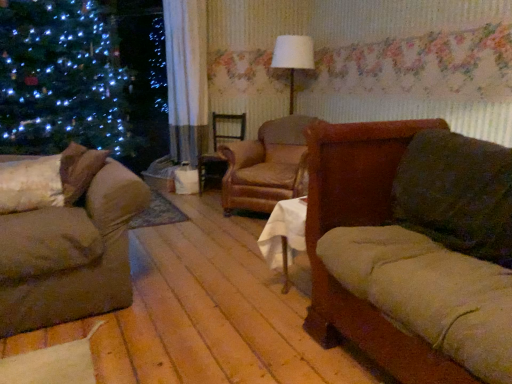
Describe the element at coordinates (362, 224) in the screenshot. I see `velvet brown couch at right, the second studio couch in the left-to-right sequence` at that location.

Describe the element at coordinates (70, 254) in the screenshot. I see `velvet brown couch at left, the first studio couch from the left` at that location.

This screenshot has width=512, height=384. Find the location of `velvet brown couch at right, which appears as the first studio couch when viewed from the right`. velvet brown couch at right, which appears as the first studio couch when viewed from the right is located at coordinates (362, 224).

Does brown leather swivel chair at center lie behind velvet brown couch at left, the first studio couch from the left?

Yes.

Is brown leather swivel chair at center turned away from velvet brown couch at left, which is counted as the 2th studio couch, starting from the right?

No, brown leather swivel chair at center's orientation is not away from velvet brown couch at left, which is counted as the 2th studio couch, starting from the right.

From the image's perspective, is brown leather swivel chair at center on velvet brown couch at left, the first studio couch from the left?

Yes, from the image's perspective, brown leather swivel chair at center is above velvet brown couch at left, the first studio couch from the left.

Looking at this image, is brown leather swivel chair at center far from velvet brown couch at left, the first studio couch from the left?

Indeed, brown leather swivel chair at center is not near velvet brown couch at left, the first studio couch from the left.

Is brown leather swivel chair at center next to velvet brown couch at right, the second studio couch in the left-to-right sequence, and touching it?

No, brown leather swivel chair at center is not beside velvet brown couch at right, the second studio couch in the left-to-right sequence.

Is brown leather swivel chair at center oriented towards velvet brown couch at right, the second studio couch in the left-to-right sequence?

No, brown leather swivel chair at center is not facing towards velvet brown couch at right, the second studio couch in the left-to-right sequence.

Considering the positions of objects brown leather swivel chair at center and velvet brown couch at right, which appears as the first studio couch when viewed from the right, in the image provided, who is in front, brown leather swivel chair at center or velvet brown couch at right, which appears as the first studio couch when viewed from the right,?

A: velvet brown couch at right, which appears as the first studio couch when viewed from the right, is closer to the camera.

Is brown leather swivel chair at center to the right of velvet brown couch at right, which appears as the first studio couch when viewed from the right, from the viewer's perspective?

Incorrect, brown leather swivel chair at center is not on the right side of velvet brown couch at right, which appears as the first studio couch when viewed from the right.

Does velvet brown couch at left, which is counted as the 2th studio couch, starting from the right, appear on the left side of velvet brown couch at right, the second studio couch in the left-to-right sequence?

Yes, velvet brown couch at left, which is counted as the 2th studio couch, starting from the right, is to the left of velvet brown couch at right, the second studio couch in the left-to-right sequence.

Is velvet brown couch at left, which is counted as the 2th studio couch, starting from the right, aimed at velvet brown couch at right, which appears as the first studio couch when viewed from the right?

No, velvet brown couch at left, which is counted as the 2th studio couch, starting from the right, is not oriented towards velvet brown couch at right, which appears as the first studio couch when viewed from the right.

Can you confirm if velvet brown couch at left, the first studio couch from the left, is wider than velvet brown couch at right, the second studio couch in the left-to-right sequence?

Correct, the width of velvet brown couch at left, the first studio couch from the left, exceeds that of velvet brown couch at right, the second studio couch in the left-to-right sequence.

From the picture: Considering the sizes of velvet brown couch at left, the first studio couch from the left, and velvet brown couch at right, which appears as the first studio couch when viewed from the right, in the image, is velvet brown couch at left, the first studio couch from the left, bigger or smaller than velvet brown couch at right, which appears as the first studio couch when viewed from the right,?

Clearly, velvet brown couch at left, the first studio couch from the left, is smaller in size than velvet brown couch at right, which appears as the first studio couch when viewed from the right.

Is brown leather swivel chair at center wider than white fabric lampshade at center?

Yes.

Can you tell me how much brown leather swivel chair at center and white fabric lampshade at center differ in facing direction?

The angle between the facing direction of brown leather swivel chair at center and the facing direction of white fabric lampshade at center is 0.903 degrees.

From the image's perspective, which is below, brown leather swivel chair at center or white fabric lampshade at center?

brown leather swivel chair at center is shown below in the image.

From a real-world perspective, is brown leather swivel chair at center on top of white fabric lampshade at center?

No, from a real-world perspective, brown leather swivel chair at center is not above white fabric lampshade at center.

Considering the positions of objects velvet brown couch at right, which appears as the first studio couch when viewed from the right, and white fabric lampshade at center in the image provided, who is behind, velvet brown couch at right, which appears as the first studio couch when viewed from the right, or white fabric lampshade at center?

white fabric lampshade at center is further away from the camera.

Considering the sizes of velvet brown couch at right, the second studio couch in the left-to-right sequence, and white fabric lampshade at center in the image, is velvet brown couch at right, the second studio couch in the left-to-right sequence, taller or shorter than white fabric lampshade at center?

Clearly, velvet brown couch at right, the second studio couch in the left-to-right sequence, is taller compared to white fabric lampshade at center.

Consider the image. From a real-world perspective, is velvet brown couch at right, which appears as the first studio couch when viewed from the right, above or below white fabric lampshade at center?

In terms of real-world spatial position, velvet brown couch at right, which appears as the first studio couch when viewed from the right, is below white fabric lampshade at center.

Based on the photo, measure the distance between velvet brown couch at right, which appears as the first studio couch when viewed from the right, and white fabric lampshade at center.

They are 2.61 meters apart.

Considering the positions of point (289, 181) and point (349, 318), is point (289, 181) closer or farther from the camera than point (349, 318)?

Point (289, 181) is farther from the camera than point (349, 318).

Considering the relative sizes of leather armchair at center and velvet brown couch at right, which appears as the first studio couch when viewed from the right, in the image provided, is leather armchair at center taller than velvet brown couch at right, which appears as the first studio couch when viewed from the right,?

In fact, leather armchair at center may be shorter than velvet brown couch at right, which appears as the first studio couch when viewed from the right.

From a real-world perspective, between leather armchair at center and velvet brown couch at right, the second studio couch in the left-to-right sequence, who is vertically lower?

leather armchair at center is physically lower.

Considering the relative positions of leather armchair at center and velvet brown couch at right, which appears as the first studio couch when viewed from the right, in the image provided, is leather armchair at center to the right of velvet brown couch at right, which appears as the first studio couch when viewed from the right, from the viewer's perspective?

In fact, leather armchair at center is to the left of velvet brown couch at right, which appears as the first studio couch when viewed from the right.

From a real-world perspective, which is physically above, leather armchair at center or fluffy white pillow at left?

In real-world perspective, fluffy white pillow at left is above.

Is leather armchair at center situated inside fluffy white pillow at left or outside?

leather armchair at center cannot be found inside fluffy white pillow at left.

Is fluffy white pillow at left at the back of leather armchair at center?

No, fluffy white pillow at left is not at the back of leather armchair at center.

Which of these two, leather armchair at center or fluffy white pillow at left, stands shorter?

fluffy white pillow at left is shorter.

You are a GUI agent. You are given a task and a screenshot of the screen. Output one action in this format:
    pyautogui.click(x=<x>, y=<y>)
    Task: Click on the 1st studio couch in front when counting from the brown leather swivel chair at center
    The width and height of the screenshot is (512, 384).
    Given the screenshot: What is the action you would take?
    pyautogui.click(x=70, y=254)

Image resolution: width=512 pixels, height=384 pixels. Identify the location of swivel chair above the velvet brown couch at right, which appears as the first studio couch when viewed from the right (from the image's perspective). (217, 143).

Looking at the image, which one is located closer to leather armchair at center, velvet brown couch at left, which is counted as the 2th studio couch, starting from the right, or brown leather swivel chair at center?

brown leather swivel chair at center is closer to leather armchair at center.

Considering their positions, is velvet brown couch at right, the second studio couch in the left-to-right sequence, positioned closer to velvet brown couch at left, the first studio couch from the left, than leather armchair at center?

Among the two, velvet brown couch at right, the second studio couch in the left-to-right sequence, is located nearer to velvet brown couch at left, the first studio couch from the left.

Based on their spatial positions, is velvet brown couch at right, which appears as the first studio couch when viewed from the right, or brown leather swivel chair at center closer to leather armchair at center?

Based on the image, brown leather swivel chair at center appears to be nearer to leather armchair at center.

Estimate the real-world distances between objects in this image. Which object is closer to leather armchair at center, white fabric lampshade at center or brown leather swivel chair at center?

Based on the image, brown leather swivel chair at center appears to be nearer to leather armchair at center.

From the image, which object appears to be farther from white fabric lampshade at center, leather armchair at center or velvet brown couch at left, which is counted as the 2th studio couch, starting from the right?

velvet brown couch at left, which is counted as the 2th studio couch, starting from the right, is positioned further to the anchor white fabric lampshade at center.

Based on their spatial positions, is fluffy white pillow at left or brown leather swivel chair at center further from leather armchair at center?

fluffy white pillow at left lies further to leather armchair at center than the other object.

From the image, which object appears to be nearer to white fabric lampshade at center, velvet brown couch at left, the first studio couch from the left, or velvet brown couch at right, which appears as the first studio couch when viewed from the right?

velvet brown couch at right, which appears as the first studio couch when viewed from the right.

Which object lies nearer to the anchor point leather armchair at center, fluffy white pillow at left or velvet brown couch at right, which appears as the first studio couch when viewed from the right?

velvet brown couch at right, which appears as the first studio couch when viewed from the right.

This screenshot has width=512, height=384. Find the location of `studio couch between velvet brown couch at right, the second studio couch in the left-to-right sequence, and leather armchair at center, along the z-axis`. studio couch between velvet brown couch at right, the second studio couch in the left-to-right sequence, and leather armchair at center, along the z-axis is located at coordinates (70, 254).

Where is `studio couch between velvet brown couch at right, the second studio couch in the left-to-right sequence, and brown leather swivel chair at center in the front-back direction`? Image resolution: width=512 pixels, height=384 pixels. studio couch between velvet brown couch at right, the second studio couch in the left-to-right sequence, and brown leather swivel chair at center in the front-back direction is located at coordinates [x=70, y=254].

Locate an element on the screen. This screenshot has height=384, width=512. lamp between fluffy white pillow at left and brown leather swivel chair at center from front to back is located at coordinates (293, 58).

This screenshot has width=512, height=384. What are the coordinates of `pillow between velvet brown couch at right, the second studio couch in the left-to-right sequence, and brown leather swivel chair at center from front to back` in the screenshot? It's located at (30, 184).